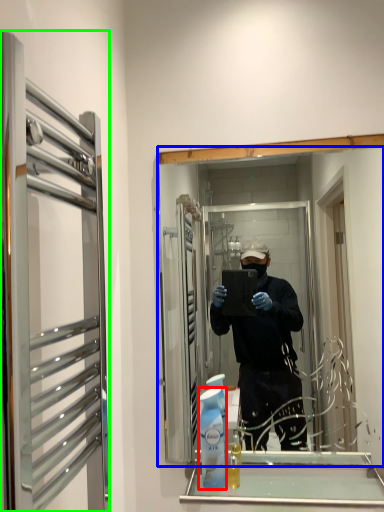
Question: Which is farther away from cleaning product (highlighted by a red box)? mirror (highlighted by a blue box) or glass door (highlighted by a green box)?

Choices:
 (A) mirror
 (B) glass door

Answer: (A)